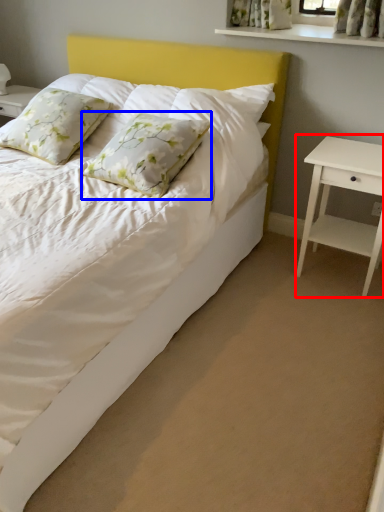
Question: Which point is further to the camera, nightstand (highlighted by a red box) or pillow (highlighted by a blue box)?

Choices:
 (A) nightstand
 (B) pillow

Answer: (A)